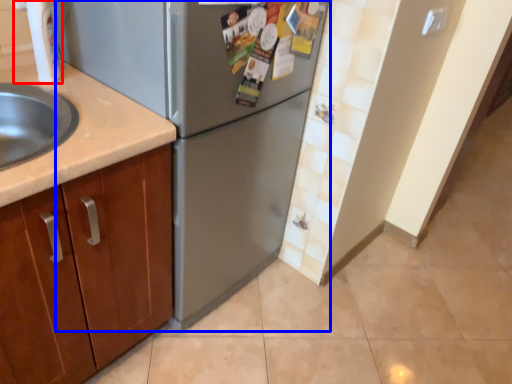
Question: Which object appears farthest to the camera in this image, faucet (highlighted by a red box) or refrigerator (highlighted by a blue box)?

Choices:
 (A) faucet
 (B) refrigerator

Answer: (A)